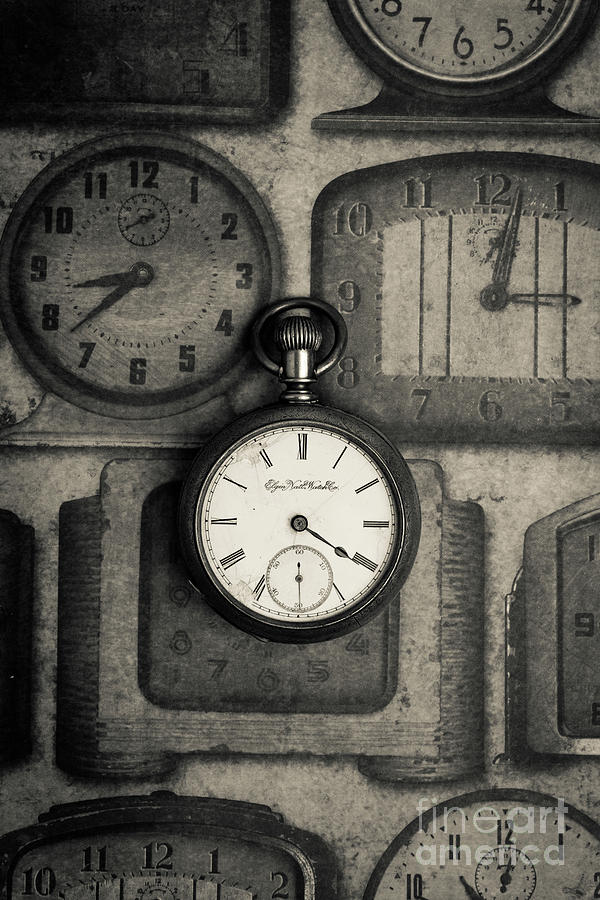
Identify the location of part of clock that shows seconds. point(308,559).